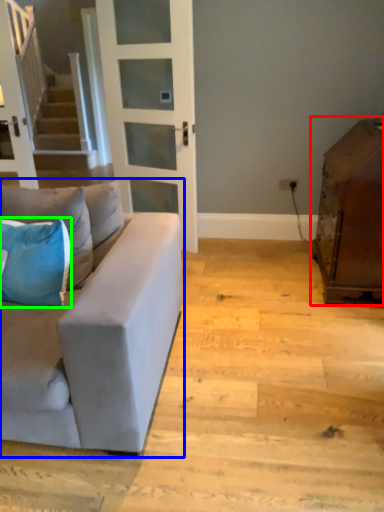
Question: Which is nearer to the cabinetry (highlighted by a red box)? studio couch (highlighted by a blue box) or pillow (highlighted by a green box).

Choices:
 (A) studio couch
 (B) pillow

Answer: (A)